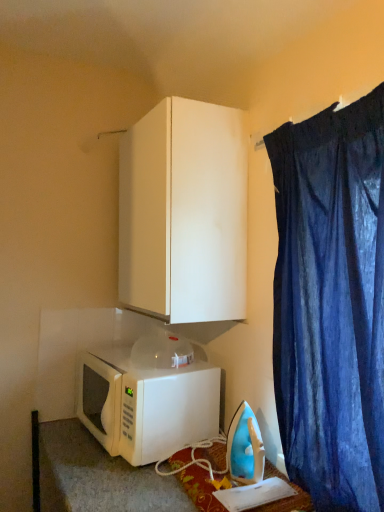
Where is `dark blue fabric at upper right`? dark blue fabric at upper right is located at coordinates (331, 303).

Describe the element at coordinates (146, 404) in the screenshot. The height and width of the screenshot is (512, 384). I see `white matte microwave at lower left` at that location.

Locate an element on the screen. This screenshot has width=384, height=512. blue plastic iron at lower right is located at coordinates (245, 447).

Is white matte cabinet at upper center located within dark blue fabric at upper right?

No, white matte cabinet at upper center is not a part of dark blue fabric at upper right.

How far apart are dark blue fabric at upper right and white matte cabinet at upper center?

dark blue fabric at upper right is 40.50 centimeters from white matte cabinet at upper center.

Can you confirm if dark blue fabric at upper right is shorter than white matte cabinet at upper center?

No.

From the image's perspective, is dark blue fabric at upper right located above or below white matte microwave at lower left?

Clearly, from the image's perspective, dark blue fabric at upper right is above white matte microwave at lower left.

From the picture: Is dark blue fabric at upper right positioned before white matte microwave at lower left?

Yes, dark blue fabric at upper right is in front of white matte microwave at lower left.

Does dark blue fabric at upper right contain white matte microwave at lower left?

No, dark blue fabric at upper right does not contain white matte microwave at lower left.

Does point (338, 166) lie behind point (93, 387)?

That is False.

Does point (228, 443) appear closer or farther from the camera than point (177, 257)?

Point (228, 443).

Identify the location of appliance below the white matte cabinet at upper center (from the image's perspective). The width and height of the screenshot is (384, 512). 245,447.

From their relative heights in the image, would you say blue plastic iron at lower right is taller or shorter than white matte cabinet at upper center?

Clearly, blue plastic iron at lower right is shorter compared to white matte cabinet at upper center.

Who is bigger, blue plastic iron at lower right or white matte cabinet at upper center?

With larger size is white matte cabinet at upper center.

Which is closer, (x=183, y=426) or (x=238, y=429)?

Clearly, point (x=183, y=426) is more distant from the camera than point (x=238, y=429).

Between white matte microwave at lower left and blue plastic iron at lower right, which one has larger width?

white matte microwave at lower left is wider.

Which of these two, white matte microwave at lower left or blue plastic iron at lower right, stands shorter?

blue plastic iron at lower right is shorter.

Considering the sizes of white matte microwave at lower left and blue plastic iron at lower right in the image, is white matte microwave at lower left bigger or smaller than blue plastic iron at lower right?

Considering their sizes, white matte microwave at lower left takes up more space than blue plastic iron at lower right.

Locate an element on the screen. cabinetry on the left of dark blue fabric at upper right is located at coordinates (184, 213).

How many degrees apart are the facing directions of white matte cabinet at upper center and dark blue fabric at upper right?

The angle between the facing direction of white matte cabinet at upper center and the facing direction of dark blue fabric at upper right is 0.992 degrees.

In the scene shown: Looking at their sizes, would you say white matte cabinet at upper center is wider or thinner than dark blue fabric at upper right?

Clearly, white matte cabinet at upper center has more width compared to dark blue fabric at upper right.

Considering the positions of point (216, 272) and point (286, 367), is point (216, 272) closer or farther from the camera than point (286, 367)?

Point (216, 272) appears to be farther away from the viewer than point (286, 367).

Between white matte microwave at lower left and dark blue fabric at upper right, which one has smaller size?

Smaller between the two is dark blue fabric at upper right.

Is white matte microwave at lower left wider or thinner than dark blue fabric at upper right?

Considering their sizes, white matte microwave at lower left looks broader than dark blue fabric at upper right.

Which is less distant, [176,422] or [357,478]?

Point [176,422] appears to be farther away from the viewer than point [357,478].

In the image, is white matte microwave at lower left on the left side or the right side of white matte cabinet at upper center?

Based on their positions, white matte microwave at lower left is located to the left of white matte cabinet at upper center.

Does point (118, 418) appear closer or farther from the camera than point (217, 320)?

Point (118, 418) is closer to the camera than point (217, 320).

Consider the image. Considering the relative sizes of white matte microwave at lower left and white matte cabinet at upper center in the image provided, is white matte microwave at lower left smaller than white matte cabinet at upper center?

Correct, white matte microwave at lower left occupies less space than white matte cabinet at upper center.

Is white matte microwave at lower left positioned with its back to white matte cabinet at upper center?

white matte microwave at lower left does not have its back to white matte cabinet at upper center.

You are a GUI agent. You are given a task and a screenshot of the screen. Output one action in this format:
    pyautogui.click(x=<x>, y=<y>)
    Task: Click on the curtain directly beneath the white matte cabinet at upper center (from a real-world perspective)
    The image size is (384, 512).
    Given the screenshot: What is the action you would take?
    pyautogui.click(x=331, y=303)

Locate an element on the screen. This screenshot has width=384, height=512. microwave oven below the dark blue fabric at upper right (from the image's perspective) is located at coordinates (146, 404).

Considering their positions, is blue plastic iron at lower right positioned closer to dark blue fabric at upper right than white matte microwave at lower left?

blue plastic iron at lower right is positioned closer to the anchor dark blue fabric at upper right.

Based on the photo, considering their positions, is white matte cabinet at upper center positioned further to white matte microwave at lower left than blue plastic iron at lower right?

white matte cabinet at upper center is further to white matte microwave at lower left.

Looking at the image, which one is located closer to white matte cabinet at upper center, dark blue fabric at upper right or white matte microwave at lower left?

dark blue fabric at upper right.

When comparing their distances from blue plastic iron at lower right, does white matte cabinet at upper center or white matte microwave at lower left seem further?

white matte cabinet at upper center lies further to blue plastic iron at lower right than the other object.

When comparing their distances from dark blue fabric at upper right, does white matte microwave at lower left or blue plastic iron at lower right seem further?

white matte microwave at lower left.

Based on their spatial positions, is white matte cabinet at upper center or white matte microwave at lower left closer to dark blue fabric at upper right?

white matte cabinet at upper center is closer to dark blue fabric at upper right.

Considering their positions, is white matte microwave at lower left positioned further to dark blue fabric at upper right than white matte cabinet at upper center?

Among the two, white matte microwave at lower left is located further to dark blue fabric at upper right.

Based on their spatial positions, is dark blue fabric at upper right or blue plastic iron at lower right closer to white matte microwave at lower left?

Among the two, blue plastic iron at lower right is located nearer to white matte microwave at lower left.

Locate an element on the screen. The image size is (384, 512). microwave oven that lies between white matte cabinet at upper center and blue plastic iron at lower right from top to bottom is located at coordinates (146, 404).

The height and width of the screenshot is (512, 384). What are the coordinates of `appliance located between white matte microwave at lower left and dark blue fabric at upper right in the left-right direction` in the screenshot? It's located at (245, 447).

What are the coordinates of `curtain that lies between white matte cabinet at upper center and blue plastic iron at lower right from top to bottom` in the screenshot? It's located at (331, 303).

This screenshot has height=512, width=384. Identify the location of curtain between white matte cabinet at upper center and white matte microwave at lower left in the vertical direction. (331, 303).